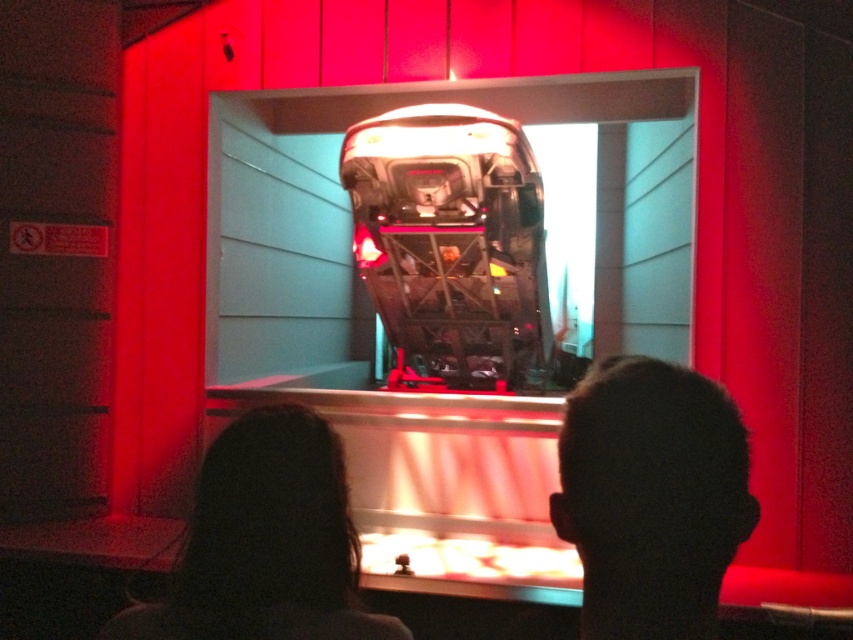
You are a visitor standing in front of the display case. You notice two mannequins inside the case with different hairstyles. The first has silky black hair at center and the second has dark brown hair at lower left. Which mannequin is closer to you?

The silky black hair at center is in front of the dark brown hair at lower left, so the mannequin with silky black hair at center is closer to you.

You are standing in front of the museum display case and want to touch the point at coordinates point (x=646, y=561). If your arm can reach up to 27 inches, will you be able to reach that point?

The point (x=646, y=561) is 27.31 inches from viewer, which is slightly beyond your arm reach of 27 inches. Therefore, you cannot reach it.

You are a photographer taking a picture of the display case. You notice two people in the background with silky black hair at center and dark brown hair at lower left. Which person is standing to the right of the other?

The silky black hair at center is positioned on the right side of dark brown hair at lower left.